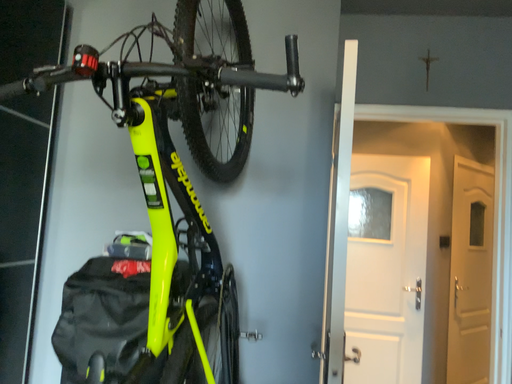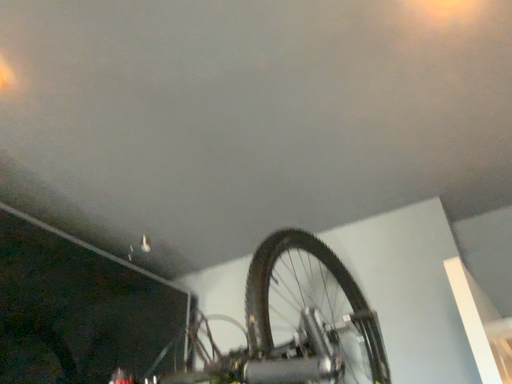
Question: Which way did the camera rotate in the video?

Choices:
 (A) rotated left
 (B) rotated right

Answer: (A)